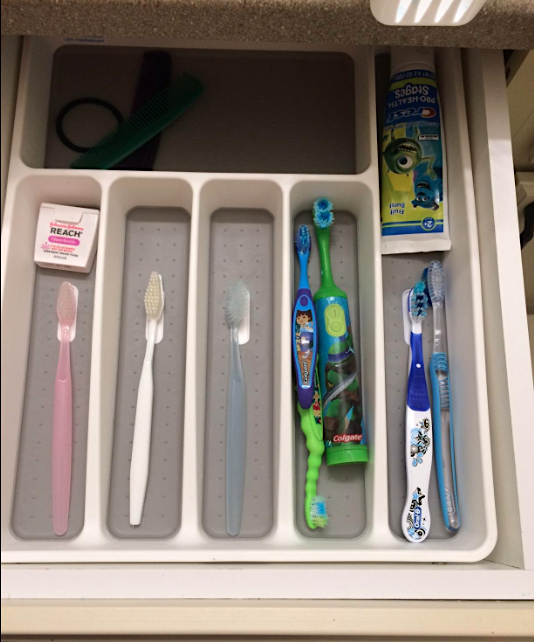
You are a GUI agent. You are given a task and a screenshot of the screen. Output one action in this format:
    pyautogui.click(x=<x>, y=<y>)
    Task: Click on the drawer
    Image resolution: width=534 pixels, height=642 pixels.
    Given the screenshot: What is the action you would take?
    pyautogui.click(x=319, y=623)